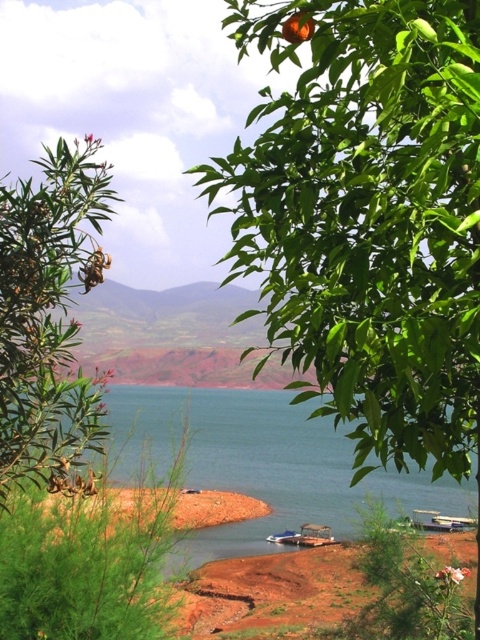
Between blue water at center and metallic silver boat at center, which one is positioned higher?

Positioned higher is blue water at center.

Is blue water at center bigger than metallic silver boat at center?

Indeed, blue water at center has a larger size compared to metallic silver boat at center.

Who is more distant from viewer, (311, 518) or (300, 541)?

Point (311, 518)

You are a GUI agent. You are given a task and a screenshot of the screen. Output one action in this format:
    pyautogui.click(x=<x>, y=<y>)
    Task: Click on the blue water at center
    
    Given the screenshot: What is the action you would take?
    pyautogui.click(x=261, y=464)

From the picture: Does blue water at center appear on the right side of green leafy shrub at left?

Correct, you'll find blue water at center to the right of green leafy shrub at left.

I want to click on blue water at center, so click(x=261, y=464).

Is point (391, 348) closer to viewer compared to point (309, 540)?

Yes, point (391, 348) is in front of point (309, 540).

Which is behind, point (441, 179) or point (278, 541)?

The point (278, 541) is more distant.

Locate an element on the screen. green leafy tree at upper right is located at coordinates (369, 218).